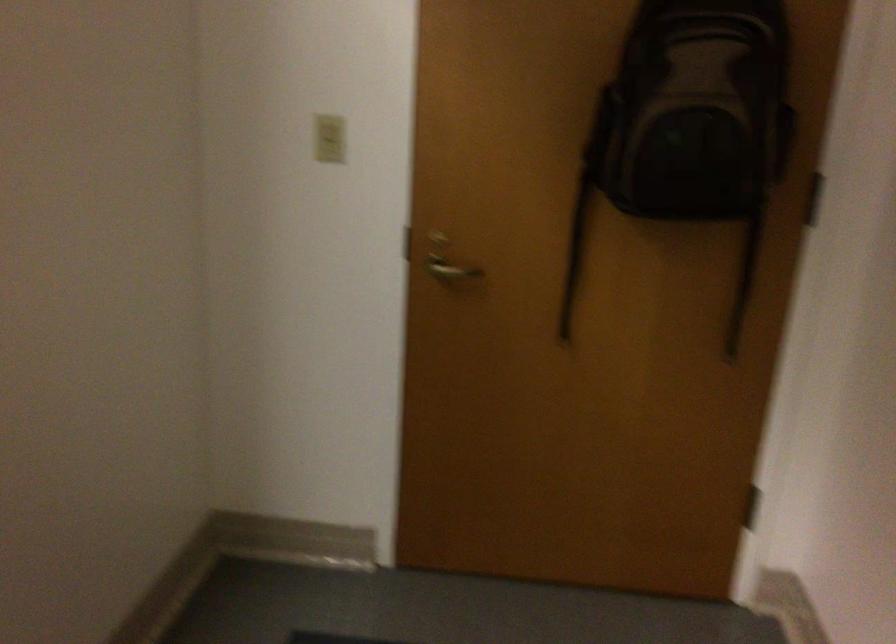
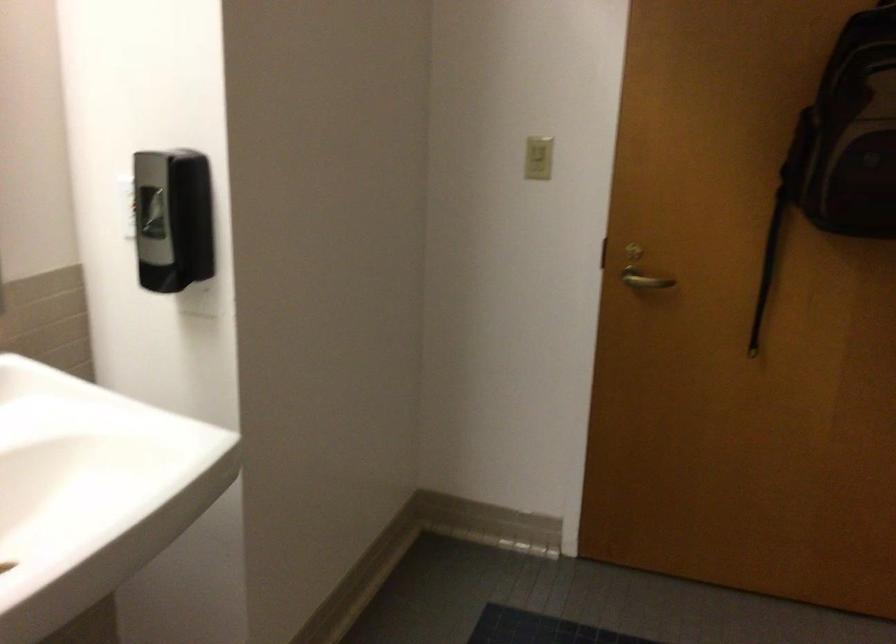
Find the pixel in the second image that matches (x=576, y=252) in the first image.

(767, 267)